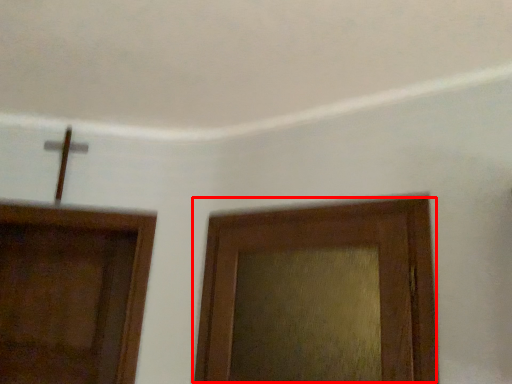
Question: Observing the image, what is the correct spatial positioning of door (annotated by the red box) in reference to door?

Choices:
 (A) left
 (B) right

Answer: (B)